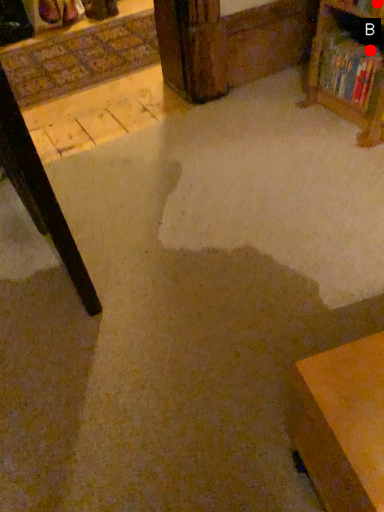
Question: Two points are circled on the image, labeled by A and B beside each circle. Which of the following is the farthest from the observer?

Choices:
 (A) A is further
 (B) B is further

Answer: (B)